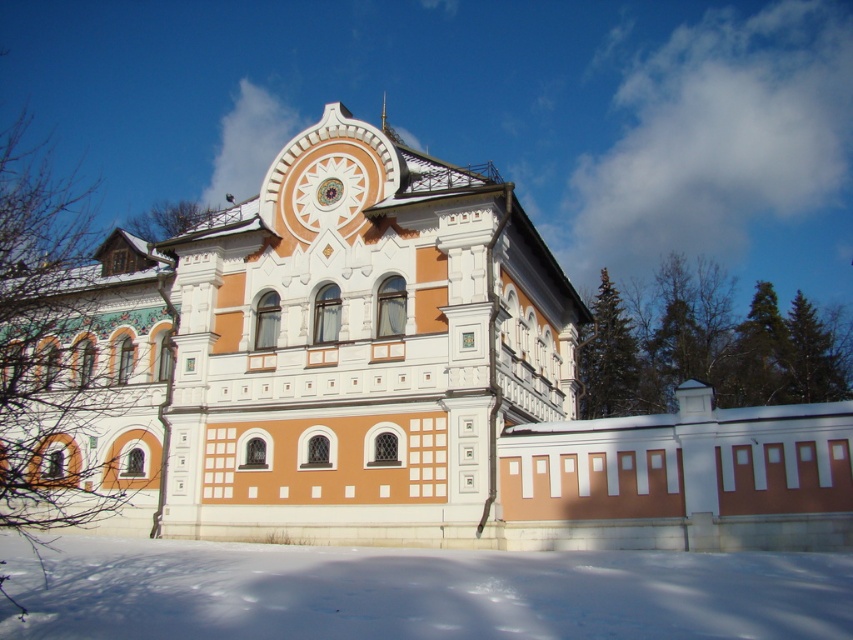
You are standing in front of the orange painted stone palace at center and want to take a photo that includes both the palace and the white powdery snow at lower center. Since the palace is taller, where should you position the camera relative to the snow to ensure both are fully visible in the frame?

The orange painted stone palace at center is taller than the white powdery snow at lower center. To include both in the photo, position the camera slightly above the snow so that the palace fits within the frame without cropping the top while still capturing the snow at the lower part of the image.

You are a drone operator tasked with capturing aerial footage of the orange painted stone palace at center and the white powdery snow at lower center. Your drone has a maximum flight range of 15 meters. Can you fly the drone from the palace to the snow without exceeding its range?

The distance between the orange painted stone palace at center and the white powdery snow at lower center is 13.56 meters, which is within the drone maximum flight range of 15 meters. Therefore, the drone can safely fly from the palace to the snow without exceeding its range.